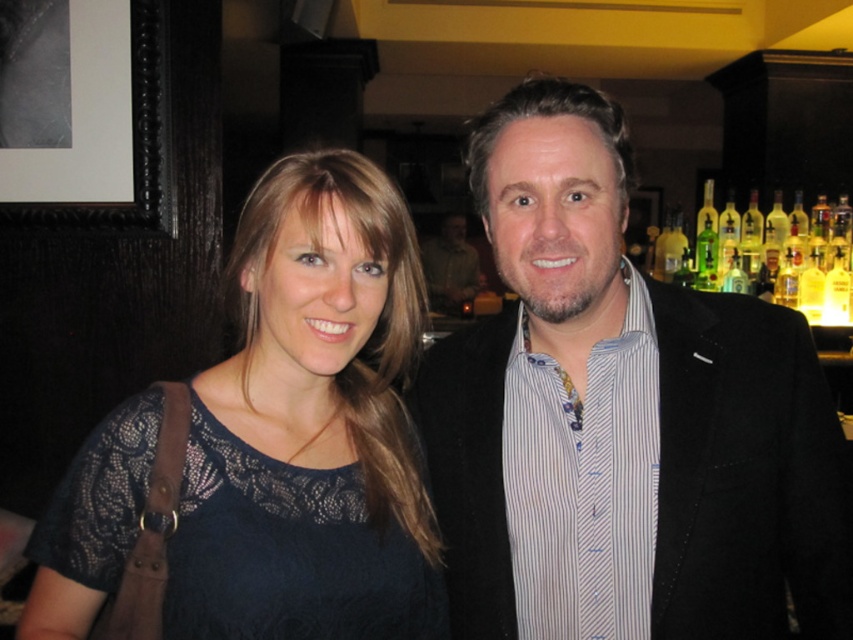
Between point (247, 440) and point (834, 273), which one is positioned in front?

Point (247, 440)

Identify the location of lace fabric dress at center. (310, 424).

Which is above, matte black jacket at center or lace fabric dress at center?

lace fabric dress at center is higher up.

Does matte black jacket at center appear on the left side of lace fabric dress at center?

Incorrect, matte black jacket at center is not on the left side of lace fabric dress at center.

Identify the location of matte black jacket at center. The image size is (853, 640). (619, 419).

Where is `matte black jacket at center`? This screenshot has width=853, height=640. matte black jacket at center is located at coordinates (619, 419).

Which is more to the right, lace fabric dress at center or matte black suit at center?

matte black suit at center

Is lace fabric dress at center to the right of matte black suit at center from the viewer's perspective?

No, lace fabric dress at center is not to the right of matte black suit at center.

At what (x,y) coordinates should I click in order to perform the action: click on lace fabric dress at center. Please return your answer as a coordinate pair (x, y). Image resolution: width=853 pixels, height=640 pixels. Looking at the image, I should click on (310, 424).